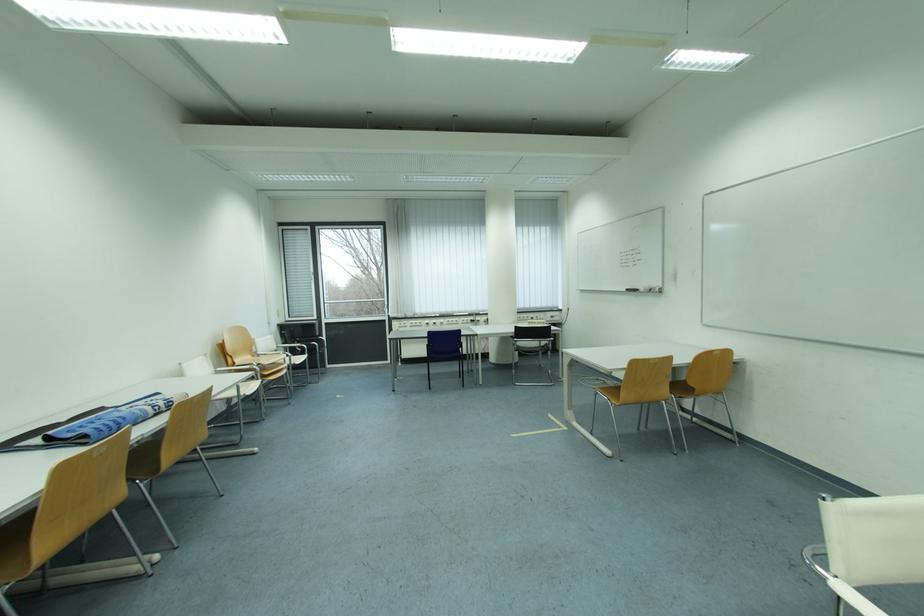
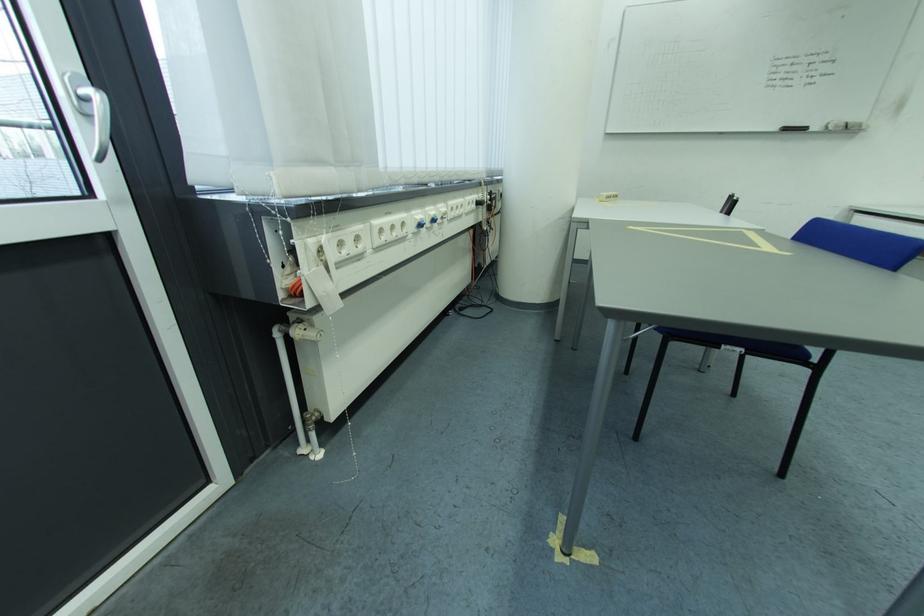
Find the pixel in the second image that matches [653,292] in the first image.

(845, 129)